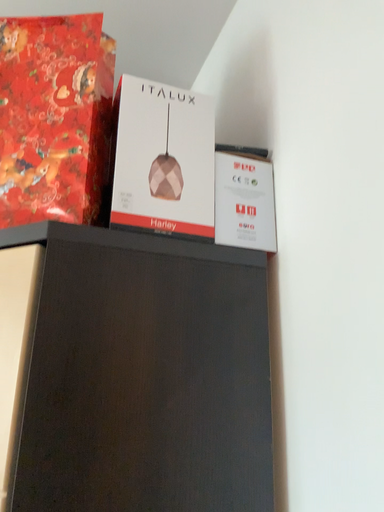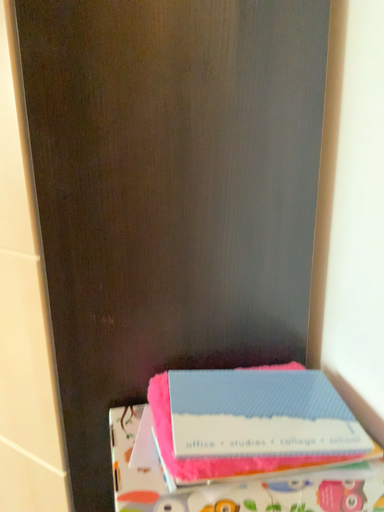
Question: Which way did the camera rotate in the video?

Choices:
 (A) rotated left
 (B) rotated right

Answer: (A)